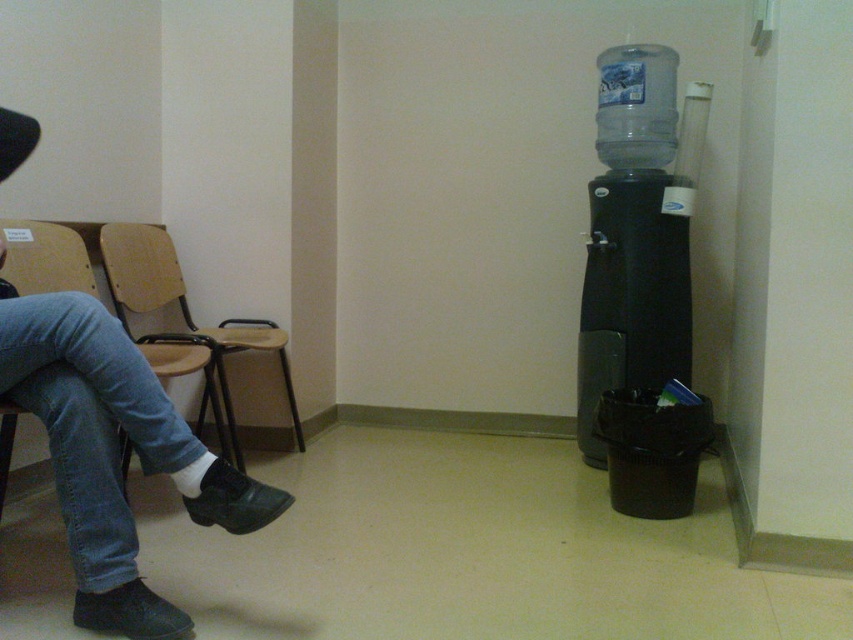
Question: Which of the following is the farthest from the observer?

Choices:
 (A) (10, 394)
 (B) (123, 368)

Answer: (A)

Question: Among these objects, which one is farthest from the camera?

Choices:
 (A) black plastic water cooler at right
 (B) wooden chair at left
 (C) clear plastic bottle at right

Answer: (A)

Question: Is black plastic water cooler at right bigger than clear plastic water cooler at right?

Choices:
 (A) no
 (B) yes

Answer: (B)

Question: Can you confirm if clear plastic bottle at right is positioned below wooden chair at left?

Choices:
 (A) no
 (B) yes

Answer: (A)

Question: Can you confirm if denim jeans at left is positioned below black plastic water cooler at right?

Choices:
 (A) no
 (B) yes

Answer: (B)

Question: Among these points, which one is farthest from the camera?

Choices:
 (A) (631, 216)
 (B) (155, 468)
 (C) (137, 449)

Answer: (A)